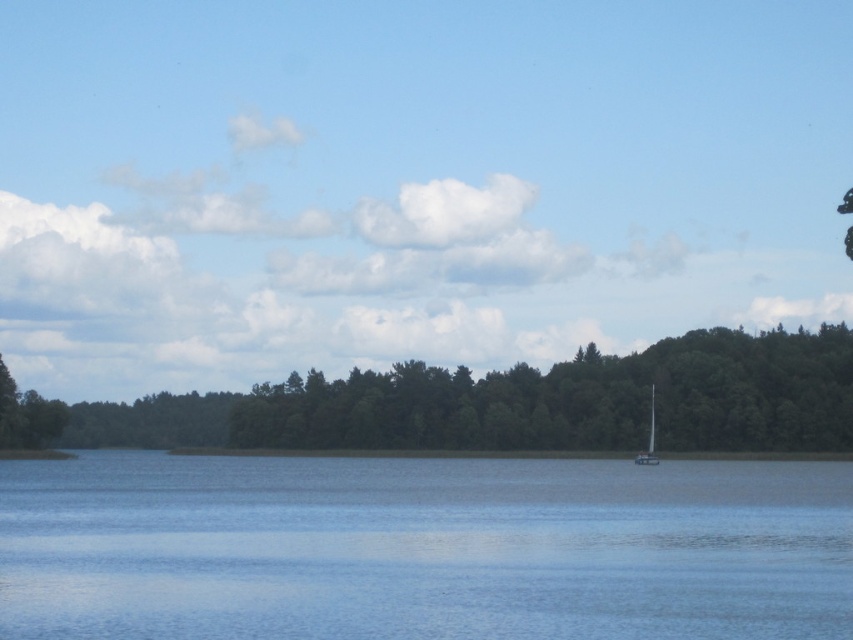
Which is in front, point (320, 428) or point (653, 417)?

Point (653, 417) is in front.

Does green leafy trees at center appear on the right side of white glossy sailboat at center-right?

No, green leafy trees at center is not to the right of white glossy sailboat at center-right.

Between point (347, 412) and point (653, 388), which one is positioned behind?

Point (347, 412)

At what (x,y) coordinates should I click in order to perform the action: click on green leafy trees at center. Please return your answer as a coordinate pair (x, y). Looking at the image, I should click on (523, 403).

Does transparent blue water at center have a greater height compared to white glossy sailboat at center-right?

Correct, transparent blue water at center is much taller as white glossy sailboat at center-right.

Locate an element on the screen. The height and width of the screenshot is (640, 853). transparent blue water at center is located at coordinates (422, 548).

Is transparent blue water at center wider than green leafy trees at center?

Incorrect, transparent blue water at center's width does not surpass green leafy trees at center's.

Who is more forward, (354, 477) or (399, 440)?

Positioned in front is point (354, 477).

You are a GUI agent. You are given a task and a screenshot of the screen. Output one action in this format:
    pyautogui.click(x=<x>, y=<y>)
    Task: Click on the transparent blue water at center
    The height and width of the screenshot is (640, 853).
    Given the screenshot: What is the action you would take?
    pyautogui.click(x=422, y=548)